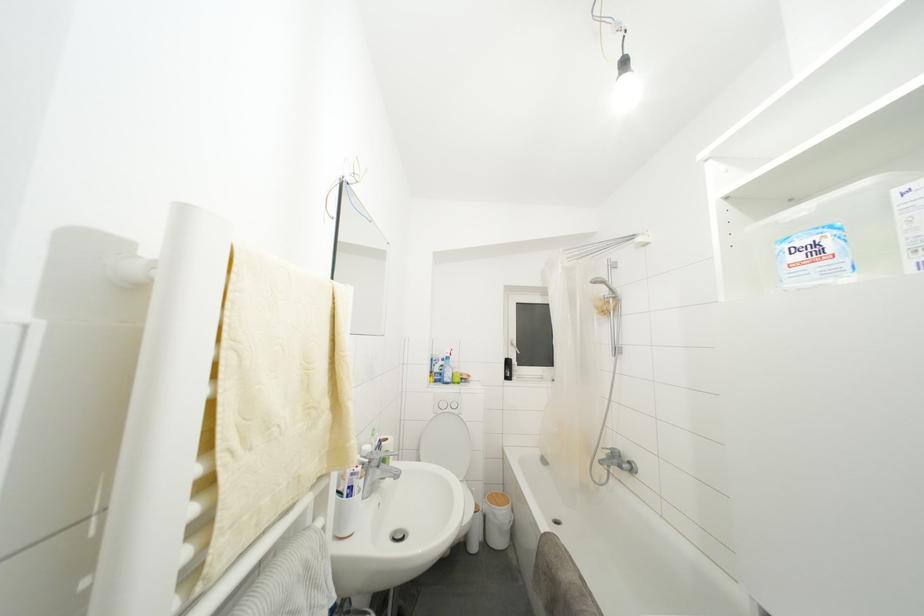
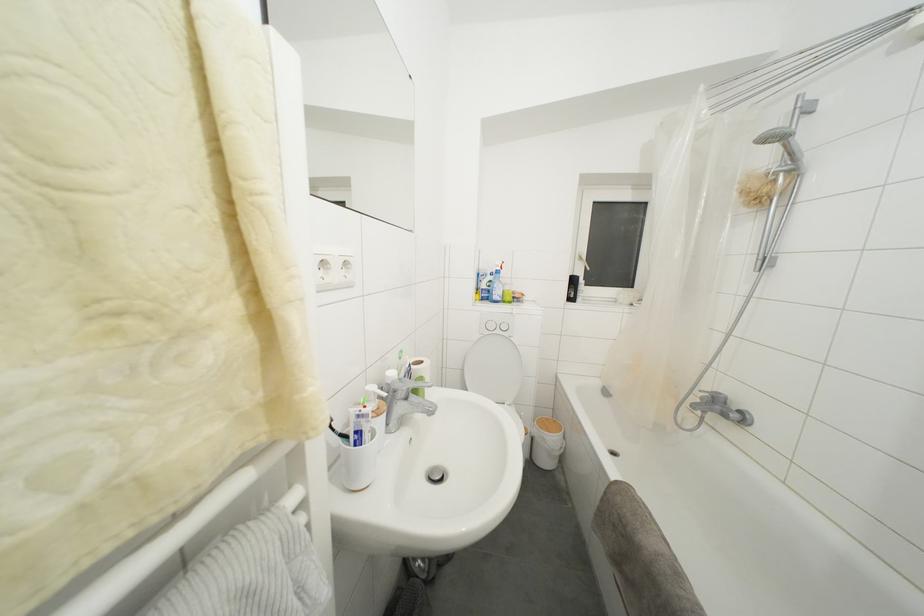
The point at (x=357, y=479) is marked in the first image. Where is the corresponding point in the second image?

(362, 421)